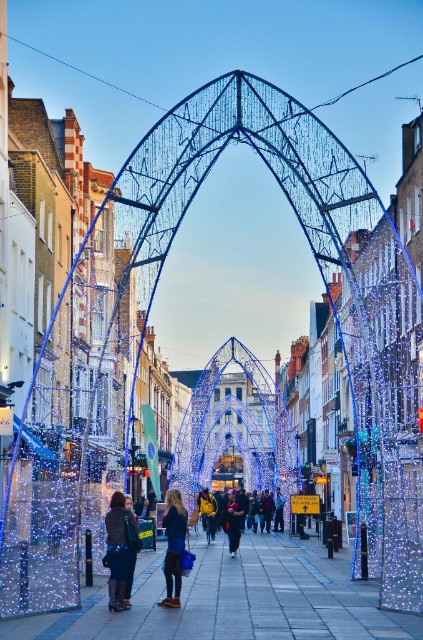
Who is taller, black fabric jacket at center or yellow fabric jacket at center?

black fabric jacket at center is taller.

Is black fabric jacket at center positioned in front of yellow fabric jacket at center?

Yes.

The height and width of the screenshot is (640, 423). Describe the element at coordinates (233, 522) in the screenshot. I see `black fabric jacket at center` at that location.

What are the coordinates of `black fabric jacket at center` in the screenshot? It's located at (233, 522).

Between illuminated wireframe arch at center and dark blue fabric coat at center, which one has less height?

dark blue fabric coat at center is shorter.

Between illuminated wireframe arch at center and dark blue fabric coat at center, which one is positioned higher?

illuminated wireframe arch at center is above.

Which is in front, point (272, 476) or point (181, 552)?

Point (181, 552) is in front.

This screenshot has height=640, width=423. What are the coordinates of `illuminated wireframe arch at center` in the screenshot? It's located at (235, 426).

Who is positioned more to the right, dark blue fabric coat at center or yellow fabric jacket at center?

yellow fabric jacket at center

Does dark blue fabric coat at center appear on the right side of yellow fabric jacket at center?

Incorrect, dark blue fabric coat at center is not on the right side of yellow fabric jacket at center.

Is point (169, 541) positioned before point (214, 500)?

That is True.

Image resolution: width=423 pixels, height=640 pixels. Identify the location of dark blue fabric coat at center. (173, 547).